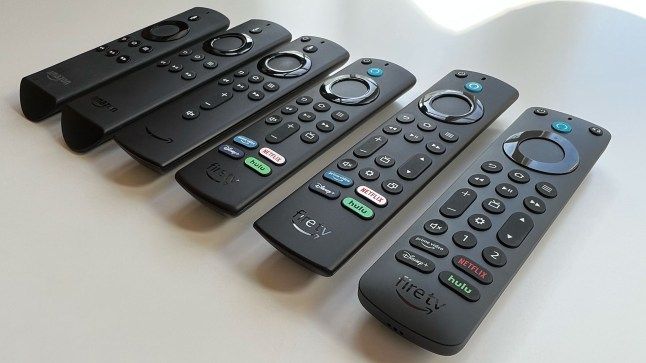
I want to click on tv remotes, so click(x=176, y=37), click(x=185, y=57), click(x=244, y=92), click(x=327, y=145), click(x=404, y=186), click(x=514, y=243).